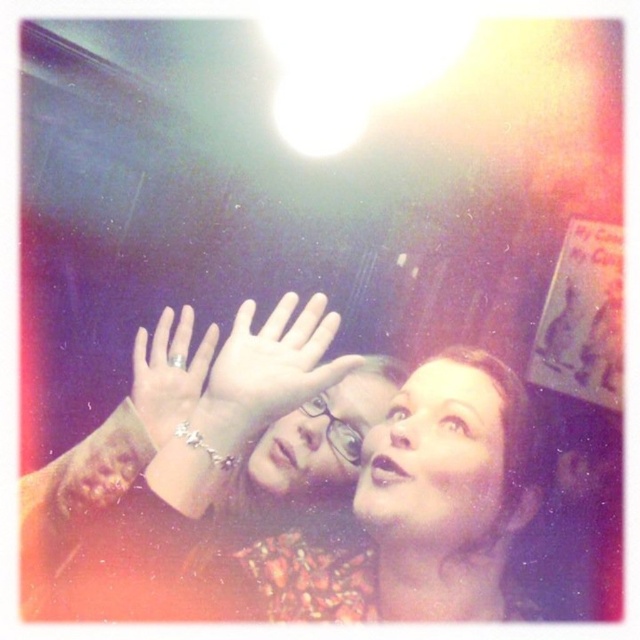
You are at a social event and want to take a photo of both the smooth skin face at upper center and the matte glass face at upper center. Which face should you focus on to ensure it appears larger in the photo?

The matte glass face at upper center is taller than the smooth skin face at upper center, so focusing on the matte glass face at upper center will ensure it appears larger in the photo.

You are a photographer trying to capture a candid shot of the matte brown hair at center. If your camera lens has a focal length of 50mm, what is the minimum recommended distance you should maintain to avoid distortion? Please provide the answer in inches based on the given information.

The minimum recommended distance to avoid distortion when using a 50mm lens is typically around 27 inches. Since the matte brown hair at center and viewer are 26.99 inches apart, you should move slightly further back to ensure the distance is at least 27 inches to prevent distortion.

You are at a social event and want to take a photo of two points in the image. The first point is at coordinates point (429, 544) and the second point is at point (284, 417). Which point is closer to you?

Point (429, 544) is closer to the viewer than point (284, 417).